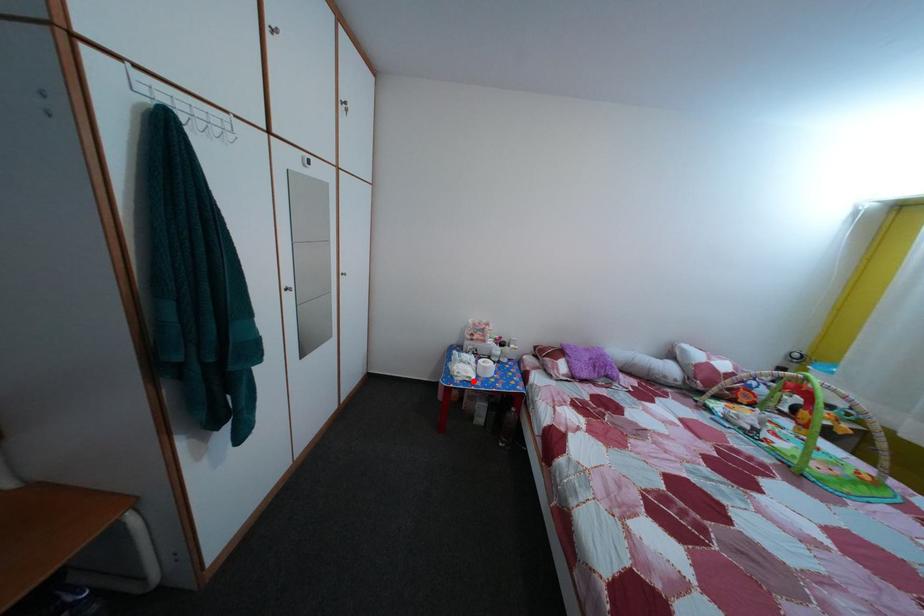
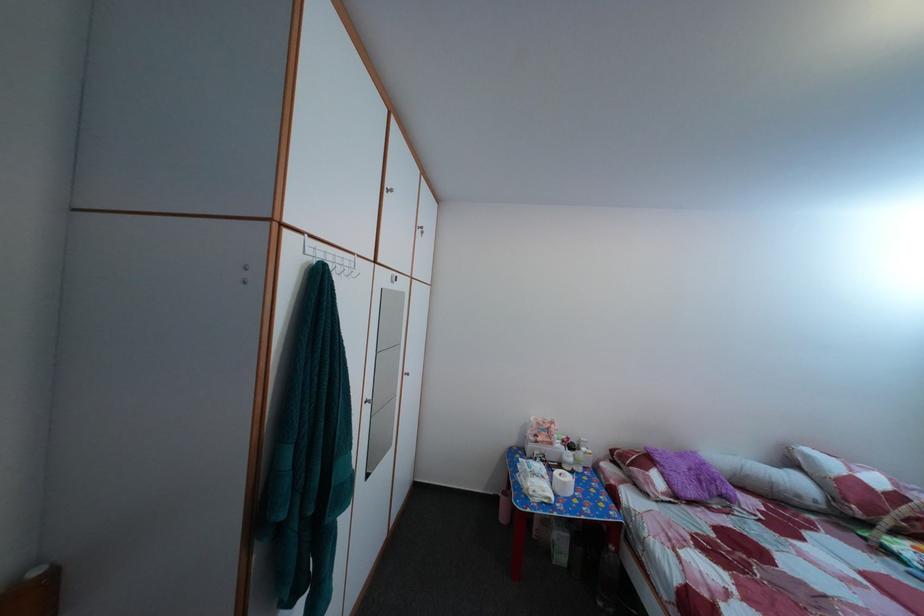
Find the pixel in the second image that matches the highlighted location in the first image.

(551, 500)